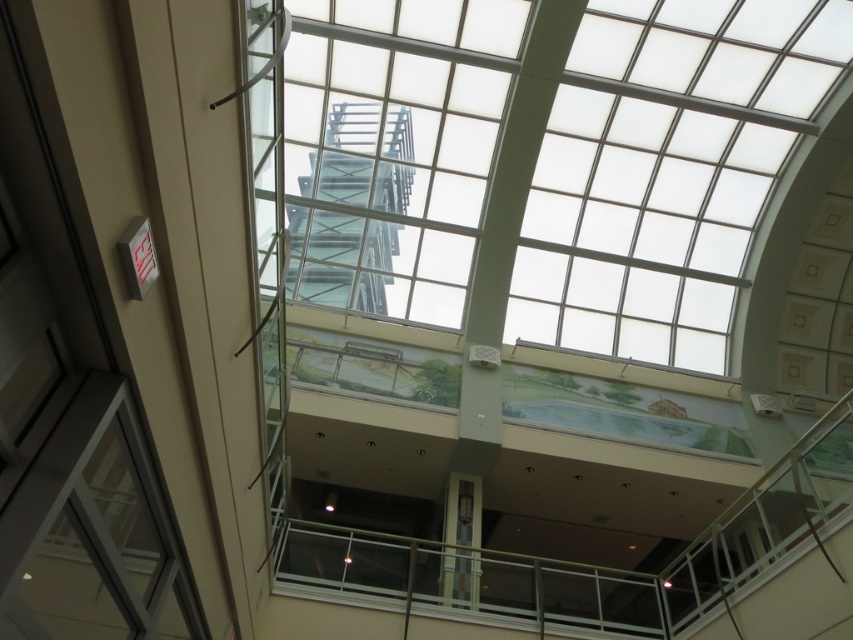
You are a delivery person carrying a large package and need to exit through the exit sign on the wall. You see the clear glass window at lower left and the clear glass staircase at center. Which object is closer to the exit sign, and can you pass through it with your package?

The clear glass window at lower left is closer to the exit sign on the wall. However, since the window is smaller than the staircase, you should check if the window is wide enough to pass through with your package before attempting to exit through it.

You are standing in the modern building and want to find the clear glass window at lower left. According to the scene description, where should you look relative to the exit sign on the wall?

The clear glass window at lower left is located at point (91, 532), which is to the left side of the exit sign mounted on the wall.